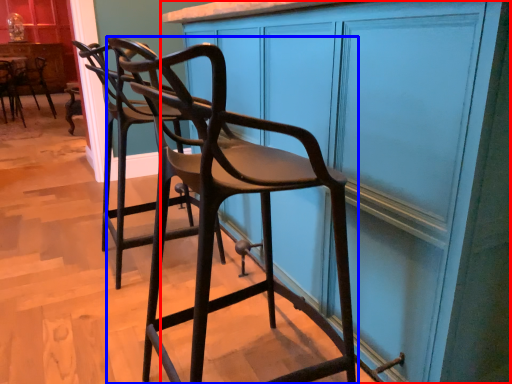
Question: Which object is further to the camera taking this photo, cabinetry (highlighted by a red box) or chair (highlighted by a blue box)?

Choices:
 (A) cabinetry
 (B) chair

Answer: (B)